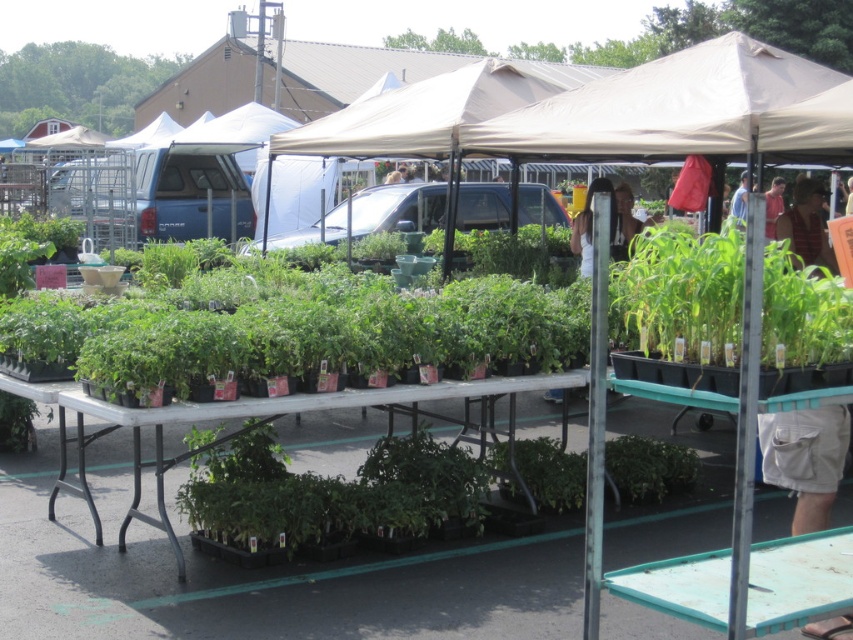
Is green matte plants at center to the left of green plastic table at center from the viewer's perspective?

Indeed, green matte plants at center is positioned on the left side of green plastic table at center.

Consider the image. Who is more distant from viewer, (x=537, y=292) or (x=569, y=376)?

Positioned behind is point (x=537, y=292).

Between point (485, 355) and point (520, 388), which one is positioned behind?

The point (485, 355) is more distant.

The image size is (853, 640). Find the location of `green matte plants at center`. green matte plants at center is located at coordinates (318, 333).

Between green matte plants at center and green matte plant at center, which one appears on the left side from the viewer's perspective?

From the viewer's perspective, green matte plants at center appears more on the left side.

Measure the distance from green matte plants at center to green matte plant at center.

They are 1.64 meters apart.

Which is behind, point (426, 301) or point (659, 442)?

Positioned behind is point (659, 442).

Find the location of `green matte plants at center`. green matte plants at center is located at coordinates (318, 333).

Which is in front, point (670, 257) or point (397, 90)?

Positioned in front is point (670, 257).

Between green leafy plant at center and beige fabric tent at center, which one is positioned higher?

beige fabric tent at center is higher up.

What do you see at coordinates (682, 296) in the screenshot? I see `green leafy plant at center` at bounding box center [682, 296].

Where is `green leafy plant at center`? The image size is (853, 640). green leafy plant at center is located at coordinates (682, 296).